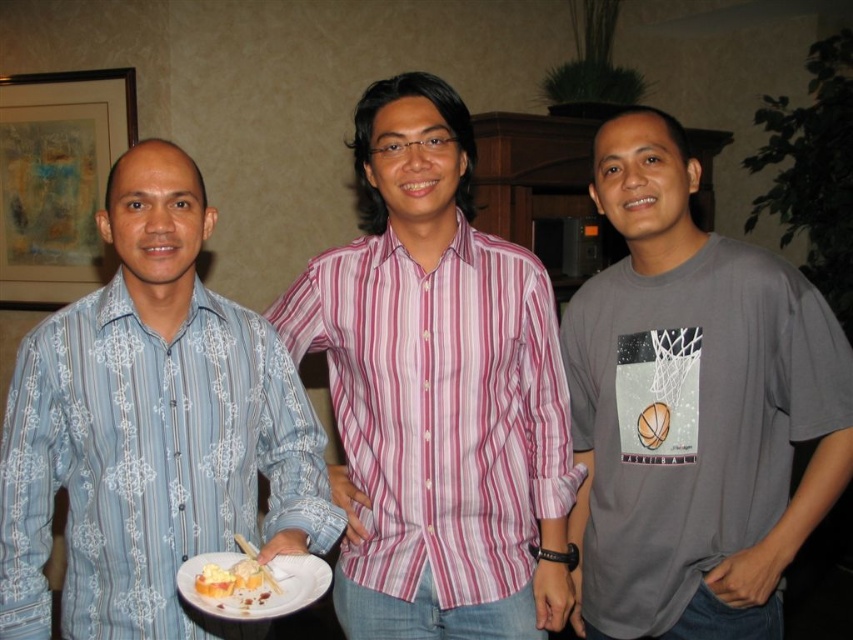
Which is above, gray cotton t-shirt at center or yellowish creamy bread at center?

gray cotton t-shirt at center is above.

Is gray cotton t-shirt at center closer to camera compared to yellowish creamy bread at center?

No, it is not.

Is point (612, 218) farther from viewer compared to point (207, 556)?

Yes, it is behind point (207, 556).

Identify the location of gray cotton t-shirt at center. (693, 408).

Can you confirm if white matte plate at center is positioned to the left of yellowish creamy bread at center?

Incorrect, white matte plate at center is not on the left side of yellowish creamy bread at center.

Is point (273, 593) positioned in front of point (231, 556)?

Yes.

At what (x,y) coordinates should I click in order to perform the action: click on white matte plate at center. Please return your answer as a coordinate pair (x, y). Image resolution: width=853 pixels, height=640 pixels. Looking at the image, I should click on (256, 586).

Where is `white matte plate at center`? The image size is (853, 640). white matte plate at center is located at coordinates (256, 586).

Who is lower down, pink striped shirt at center or white matte plate at center?

white matte plate at center

Is pink striped shirt at center positioned at the back of white matte plate at center?

Yes, pink striped shirt at center is further from the viewer.

Which is in front, point (512, 595) or point (219, 563)?

Positioned in front is point (219, 563).

This screenshot has width=853, height=640. Find the location of `pink striped shirt at center`. pink striped shirt at center is located at coordinates (437, 392).